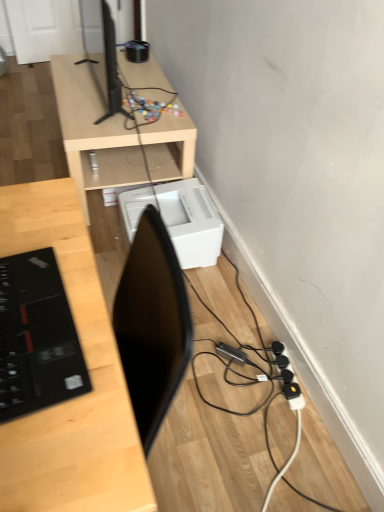
Question: Is light wood desk at center, arranged as the 1th desk when viewed from the front, taller or shorter than black glossy laptop at left?

Choices:
 (A) short
 (B) tall

Answer: (B)

Question: From a real-world perspective, is light wood desk at center, arranged as the 1th desk when viewed from the front, positioned above or below black glossy laptop at left?

Choices:
 (A) above
 (B) below

Answer: (B)

Question: Estimate the real-world distances between objects in this image. Which object is closer to the black glossy laptop at left?

Choices:
 (A) black glossy tv at upper left
 (B) white plastic printer at lower center
 (C) light wood desk at center, the second desk in the top-to-bottom sequence
 (D) light wood/finished desk at upper center, which appears as the 2th desk when ordered from the bottom
 (E) black plastic extension cord at lower right

Answer: (C)

Question: Estimate the real-world distances between objects in this image. Which object is farther from the light wood/finished desk at upper center, which appears as the 2th desk when ordered from the bottom?

Choices:
 (A) black glossy laptop at left
 (B) white plastic printer at lower center
 (C) light wood desk at center, which is the first desk from bottom to top
 (D) black plastic extension cord at lower right
 (E) black glossy tv at upper left

Answer: (A)